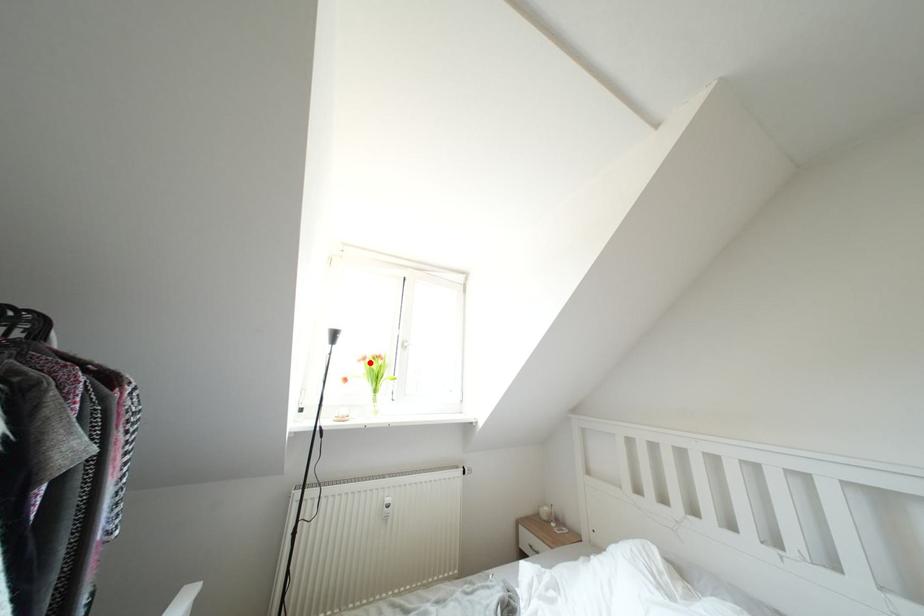
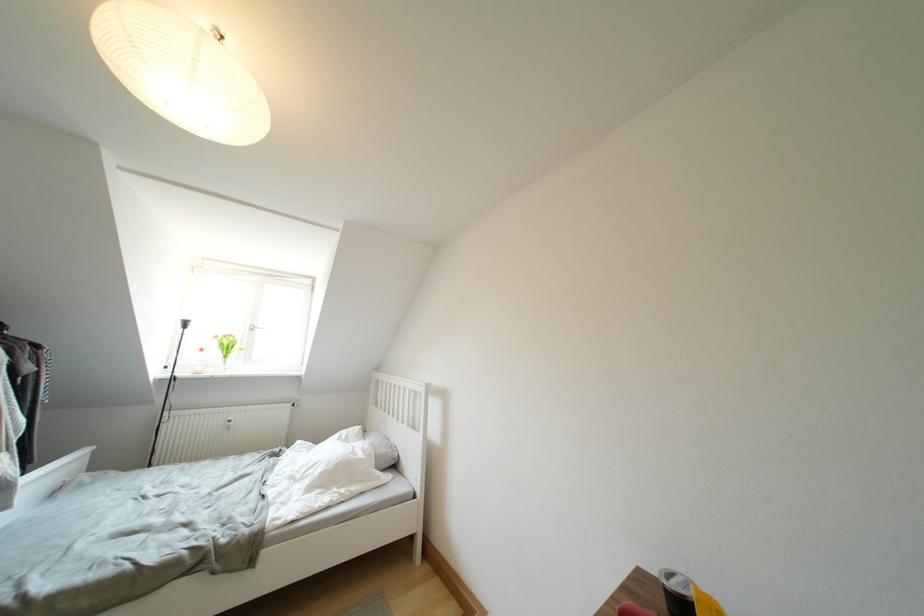
Where in the second image is the point corresponding to the highlighted location from the first image?

(222, 341)